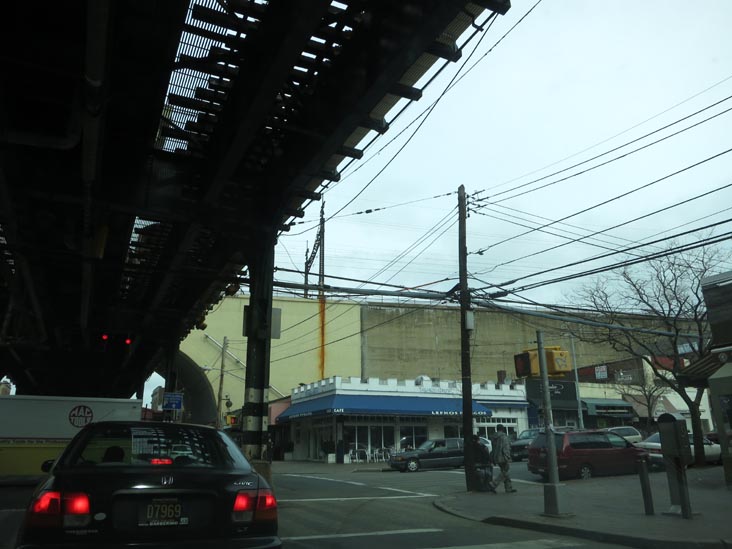
What are the coordinates of `tall wall` in the screenshot? It's located at (414, 350).